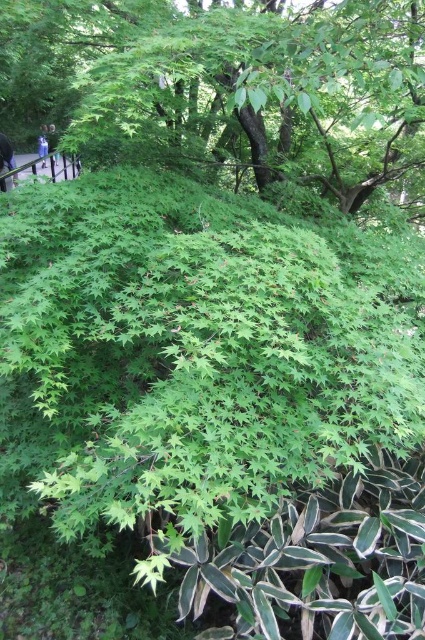
Question: Which object is closer to the camera taking this photo?

Choices:
 (A) green leafy bush at center
 (B) blue denim jeans at upper left
 (C) wooden fence at upper left

Answer: (A)

Question: Does green leafy bush at center lie behind blue denim jeans at upper left?

Choices:
 (A) no
 (B) yes

Answer: (A)

Question: Which object is closer to the camera taking this photo?

Choices:
 (A) blue denim jeans at upper left
 (B) blue fabric person at upper left
 (C) green leafy bush at center

Answer: (C)

Question: Is blue fabric at upper left above blue fabric person at upper left?

Choices:
 (A) no
 (B) yes

Answer: (A)

Question: Does blue denim jeans at upper left appear under blue fabric person at upper left?

Choices:
 (A) no
 (B) yes

Answer: (A)

Question: Which is farther from the blue fabric at upper left?

Choices:
 (A) wooden fence at upper left
 (B) blue fabric person at upper left

Answer: (A)